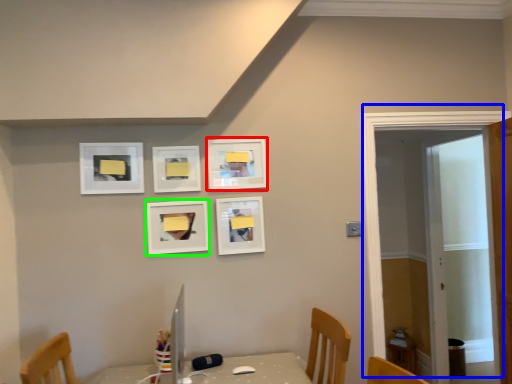
Question: Which object is positioned farthest from picture frame (highlighted by a red box)? Select from door (highlighted by a blue box) and picture frame (highlighted by a green box).

Choices:
 (A) door
 (B) picture frame

Answer: (A)